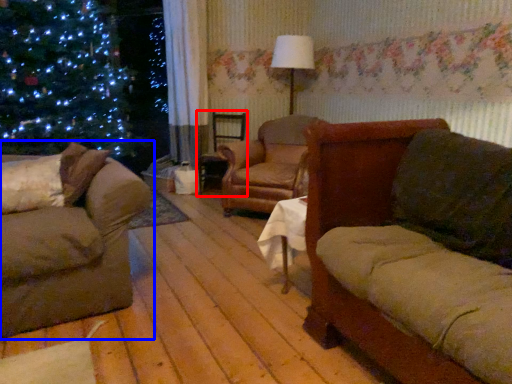
Question: Which point is further to the camera, swivel chair (highlighted by a red box) or studio couch (highlighted by a blue box)?

Choices:
 (A) swivel chair
 (B) studio couch

Answer: (A)